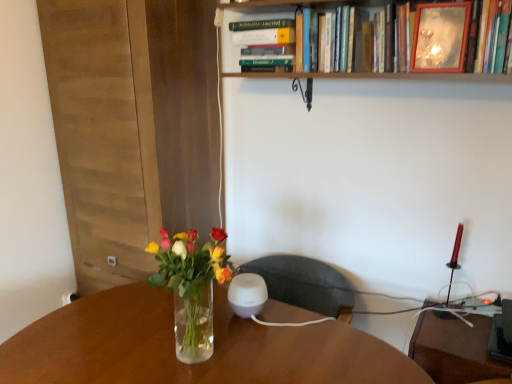
Question: Considering the relative sizes of wooden picture frame at upper right and hardcover book at upper center, the second book viewed from the right, in the image provided, is wooden picture frame at upper right shorter than hardcover book at upper center, the second book viewed from the right,?

Choices:
 (A) yes
 (B) no

Answer: (B)

Question: From a real-world perspective, is wooden picture frame at upper right beneath hardcover book at upper center, which ranks as the 1th book in left-to-right order?

Choices:
 (A) yes
 (B) no

Answer: (B)

Question: Does wooden picture frame at upper right appear on the right side of hardcover book at upper center, the second book viewed from the right?

Choices:
 (A) yes
 (B) no

Answer: (A)

Question: Is wooden picture frame at upper right behind hardcover book at upper center, which ranks as the 1th book in left-to-right order?

Choices:
 (A) yes
 (B) no

Answer: (B)

Question: Is wooden picture frame at upper right taller than hardcover book at upper center, the second book viewed from the right?

Choices:
 (A) yes
 (B) no

Answer: (A)

Question: Is wooden picture frame at upper right wider than hardcover book at upper center, which ranks as the 1th book in left-to-right order?

Choices:
 (A) yes
 (B) no

Answer: (B)

Question: Is wooden frame mirror at upper center, the first book positioned from the right, to the left of hardcover book at upper center, the second book viewed from the right, from the viewer's perspective?

Choices:
 (A) yes
 (B) no

Answer: (B)

Question: Considering the relative sizes of wooden frame mirror at upper center, positioned as the 2th book in left-to-right order, and hardcover book at upper center, the second book viewed from the right, in the image provided, is wooden frame mirror at upper center, positioned as the 2th book in left-to-right order, bigger than hardcover book at upper center, the second book viewed from the right,?

Choices:
 (A) no
 (B) yes

Answer: (B)

Question: From a real-world perspective, is wooden frame mirror at upper center, positioned as the 2th book in left-to-right order, over hardcover book at upper center, which ranks as the 1th book in left-to-right order?

Choices:
 (A) yes
 (B) no

Answer: (A)

Question: From the image's perspective, is wooden frame mirror at upper center, the first book positioned from the right, under hardcover book at upper center, which ranks as the 1th book in left-to-right order?

Choices:
 (A) yes
 (B) no

Answer: (A)

Question: Does wooden frame mirror at upper center, the first book positioned from the right, have a greater height compared to hardcover book at upper center, which ranks as the 1th book in left-to-right order?

Choices:
 (A) no
 (B) yes

Answer: (B)

Question: Considering the relative sizes of wooden frame mirror at upper center, positioned as the 2th book in left-to-right order, and hardcover book at upper center, which ranks as the 1th book in left-to-right order, in the image provided, is wooden frame mirror at upper center, positioned as the 2th book in left-to-right order, smaller than hardcover book at upper center, which ranks as the 1th book in left-to-right order,?

Choices:
 (A) no
 (B) yes

Answer: (A)

Question: From the image's perspective, is wooden frame mirror at upper center, the first book positioned from the right, under translucent glass vase at center?

Choices:
 (A) no
 (B) yes

Answer: (A)